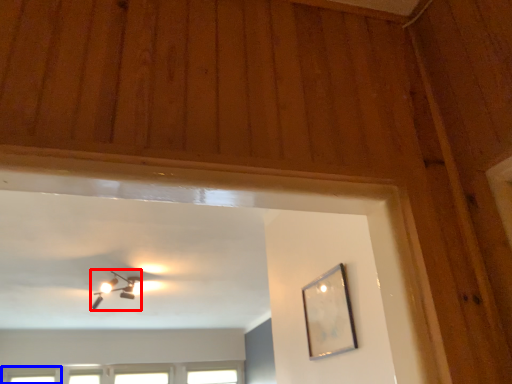
Question: Which object is closer to the camera taking this photo, lamp (highlighted by a red box) or window (highlighted by a blue box)?

Choices:
 (A) lamp
 (B) window

Answer: (A)